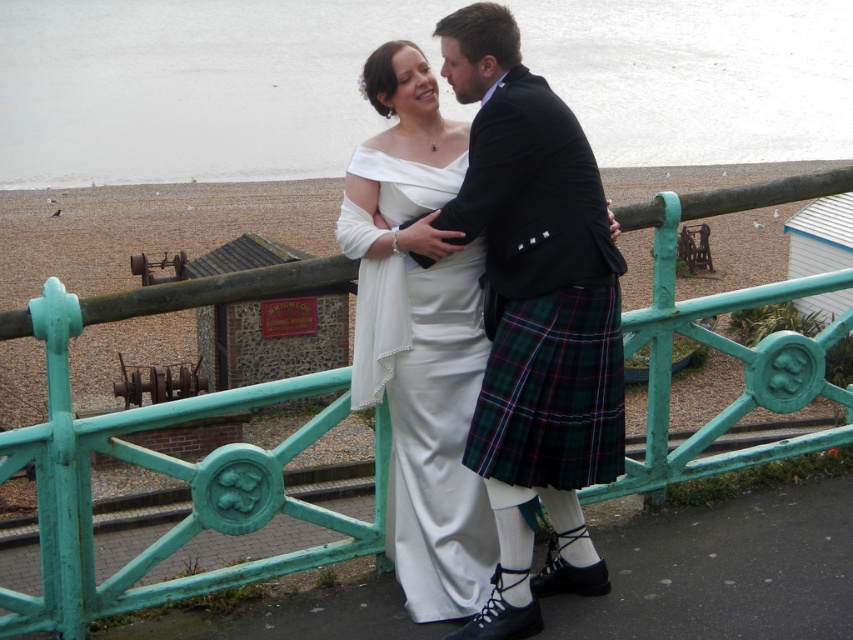
You are a photographer planning to take a picture of the couple. Since the white satin dress at center and the green plaid kilt at center are both at the center, which one should you focus on first to ensure the taller subject is in focus?

The white satin dress at center is taller than the green plaid kilt at center, so you should focus on the white satin dress at center first to ensure the taller subject is in focus.

Please look at the image. There is a point at coordinate [491,355]. What object is located at this point?

The point at coordinate [491,355] is located at the matte white dress at center.

You are standing on the promenade and want to reach the point marked at coordinates point (402, 260). If you take a step forward, will you be closer to the point than 13.19 feet?

The point (402, 260) is currently 13.19 feet away from you. If you take a step forward, you will be closer than 13.19 feet to the point (402, 260).